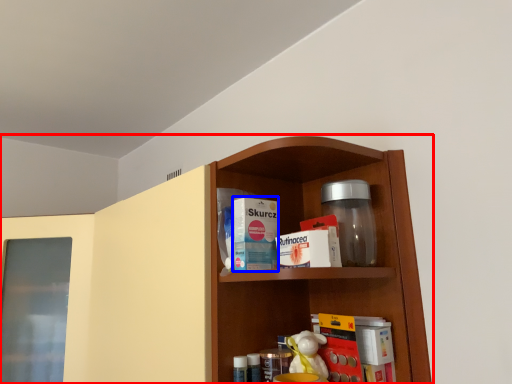
Question: Which object appears farthest to the camera in this image, shelf (highlighted by a red box) or product (highlighted by a blue box)?

Choices:
 (A) shelf
 (B) product

Answer: (B)